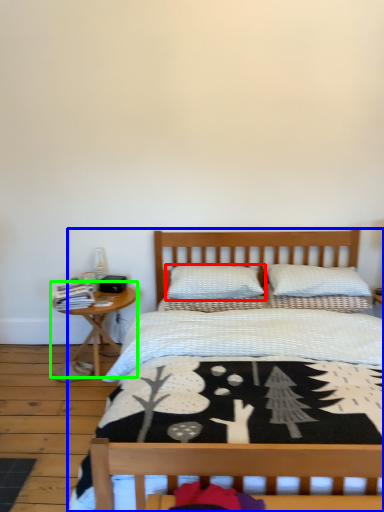
Question: Which object is the farthest from pillow (highlighted by a red box)? Choose among these: bed (highlighted by a blue box) or nightstand (highlighted by a green box).

Choices:
 (A) bed
 (B) nightstand

Answer: (A)